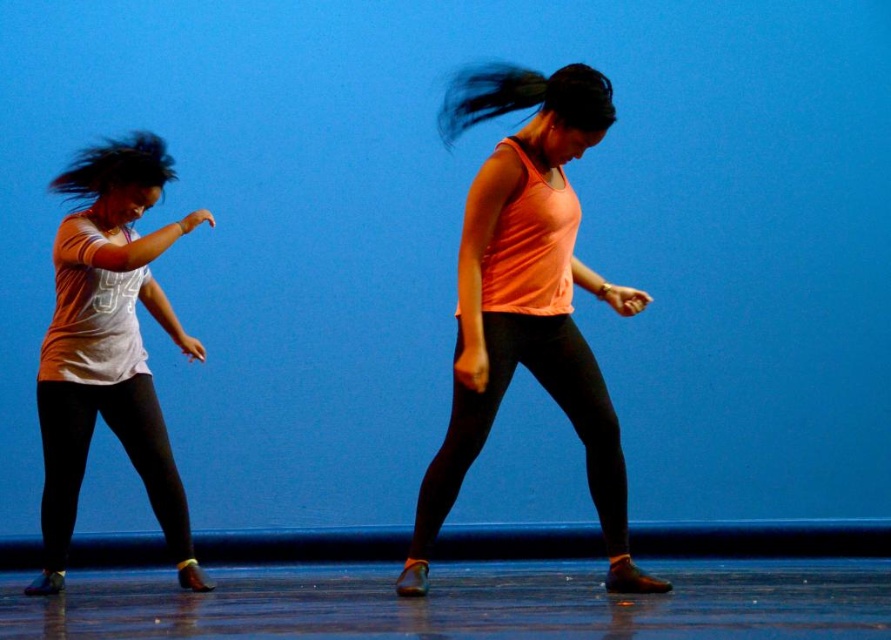
From the picture: Between black matte leggings at center and black shiny hair at left, which one is positioned lower?

black matte leggings at center is lower down.

Is point (489, 429) more distant than point (151, 186)?

Yes.

Does point (432, 481) come farther from viewer compared to point (86, 170)?

That is False.

Find the location of a particular element. This screenshot has height=640, width=891. black matte leggings at center is located at coordinates [554, 403].

Is point (544, 88) farther from camera compared to point (93, 164)?

No, (544, 88) is closer to viewer.

Which of these two, black silky hair at center or black shiny hair at left, stands taller?

With more height is black silky hair at center.

Does point (558, 80) lie in front of point (125, 182)?

Yes.

Locate an element on the screen. black silky hair at center is located at coordinates (526, 97).

Consider the image. Which of these two, white matte shirt at left or black matte leggings at center, stands taller?

Standing taller between the two is white matte shirt at left.

Can you confirm if white matte shirt at left is thinner than black matte leggings at center?

Correct, white matte shirt at left's width is less than black matte leggings at center's.

Identify the location of white matte shirt at left. (109, 348).

At what (x,y) coordinates should I click in order to perform the action: click on white matte shirt at left. Please return your answer as a coordinate pair (x, y). The width and height of the screenshot is (891, 640). Looking at the image, I should click on tap(109, 348).